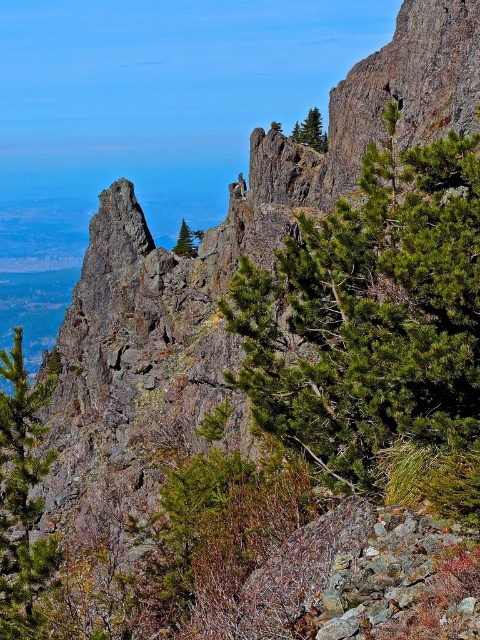
Question: Among these objects, which one is farthest from the camera?

Choices:
 (A) green matte tree at upper right
 (B) green matte tree at left
 (C) green matte tree at center

Answer: (A)

Question: Considering the real-world distances, which object is closest to the green textured tree at upper center?

Choices:
 (A) green matte tree at upper right
 (B) green matte tree at center
 (C) green needle-like tree at center-right
 (D) green matte tree at left

Answer: (A)

Question: Is green matte tree at upper right smaller than green textured tree at upper center?

Choices:
 (A) no
 (B) yes

Answer: (B)

Question: Can you confirm if green needle-like tree at center-right is smaller than green matte tree at center?

Choices:
 (A) no
 (B) yes

Answer: (B)

Question: Can you confirm if green matte tree at left is bigger than green matte tree at center?

Choices:
 (A) yes
 (B) no

Answer: (B)

Question: Among these points, which one is nearest to the camera?

Choices:
 (A) (278, 129)
 (B) (191, 257)
 (C) (434, 204)

Answer: (C)